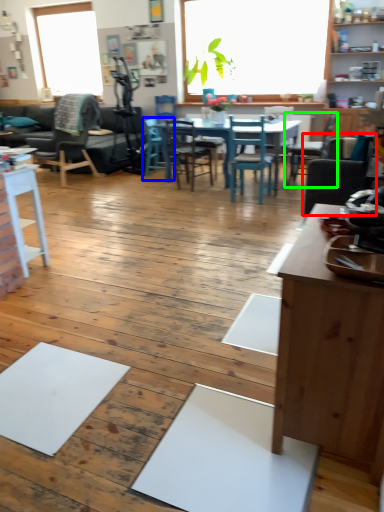
Question: Which object is positioned closest to chair (highlighted by a red box)? Select from chair (highlighted by a blue box) and chair (highlighted by a green box).

Choices:
 (A) chair
 (B) chair

Answer: (B)